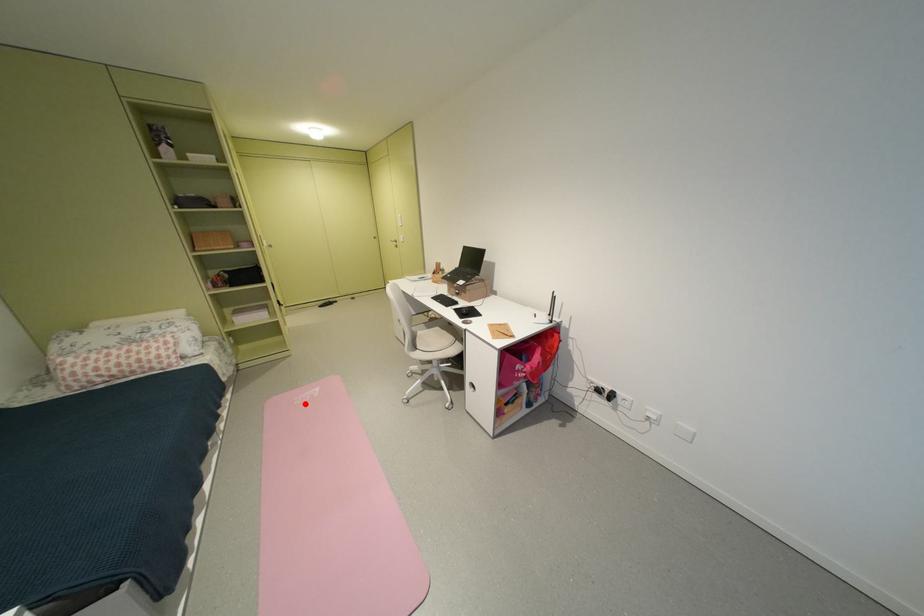
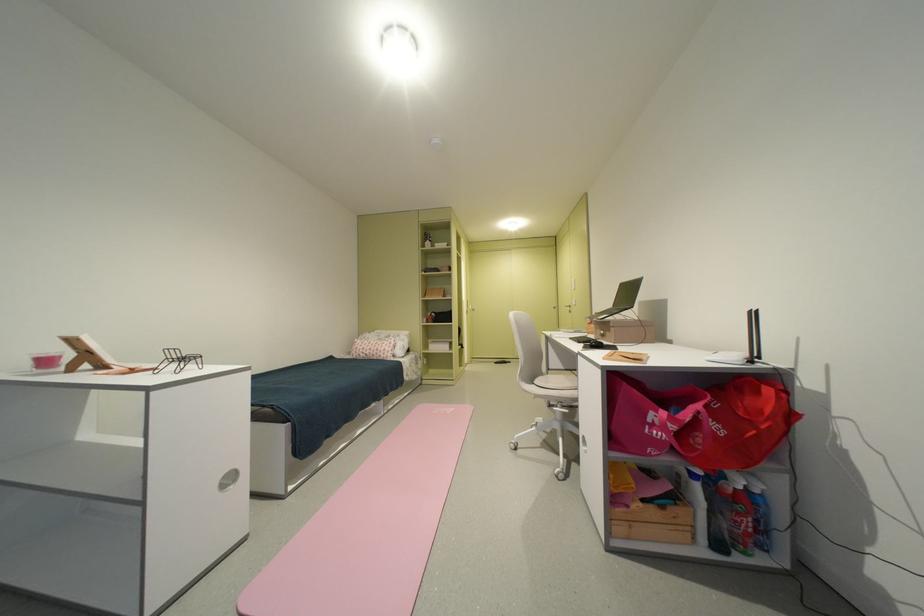
Question: I am providing you with two images of the same scene from different viewpoints. Given a red point in image1, look at the same physical point in image2. Is it:

Choices:
 (A) Closer to the viewpoint
 (B) Farther from the viewpoint

Answer: (B)